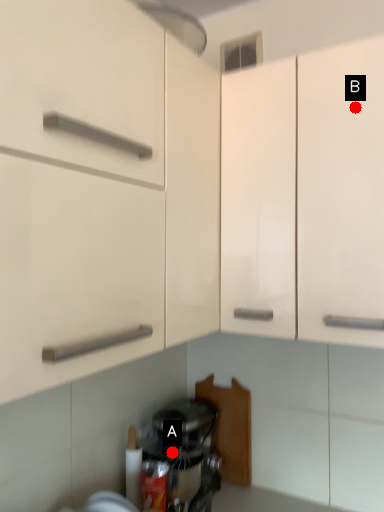
Question: Two points are circled on the image, labeled by A and B beside each circle. Which of the following is the farthest from the observer?

Choices:
 (A) A is further
 (B) B is further

Answer: (A)